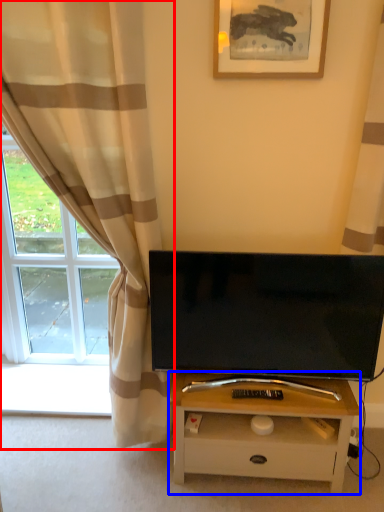
Question: Which object is closer to the camera taking this photo, curtain (highlighted by a red box) or table (highlighted by a blue box)?

Choices:
 (A) curtain
 (B) table

Answer: (A)